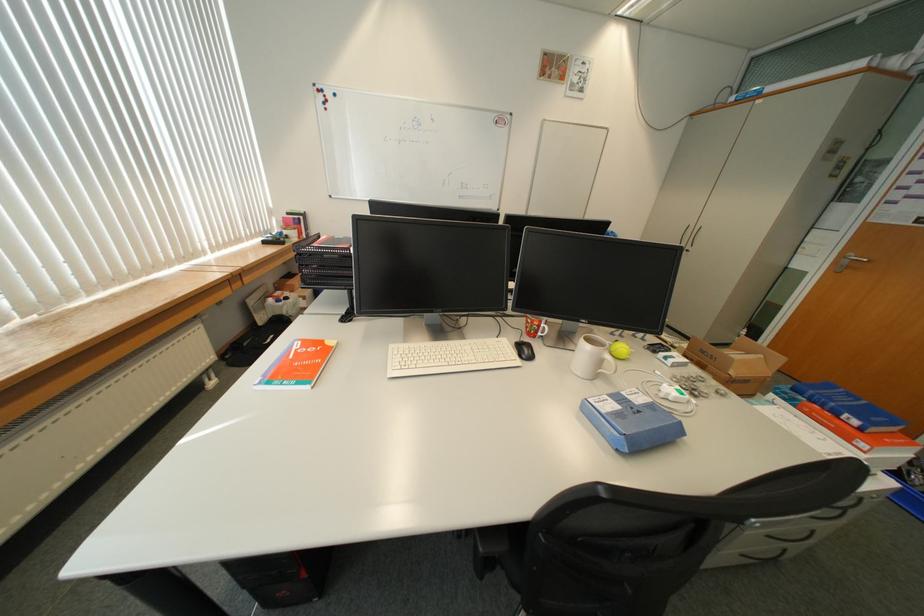
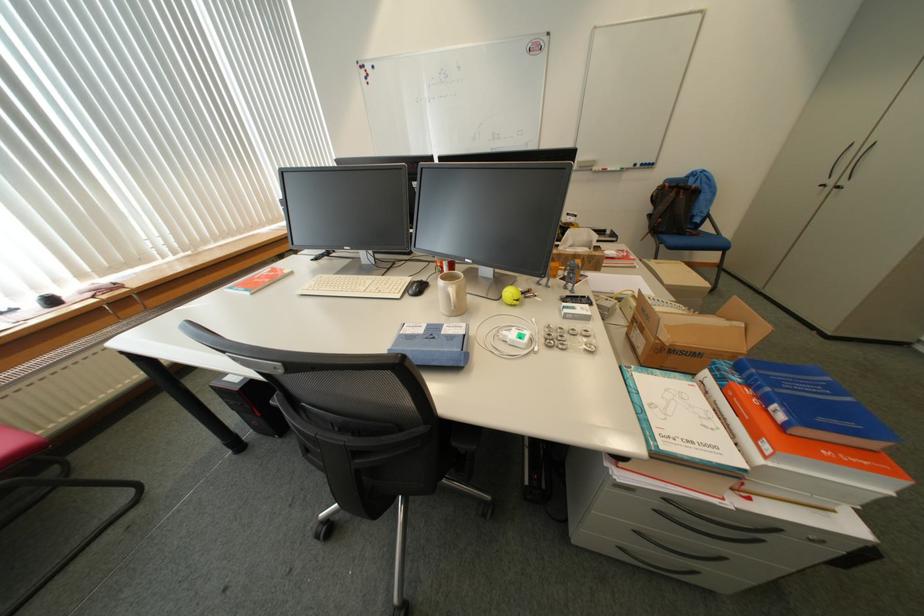
The point at (533,358) is marked in the first image. Where is the corresponding point in the second image?

(419, 293)